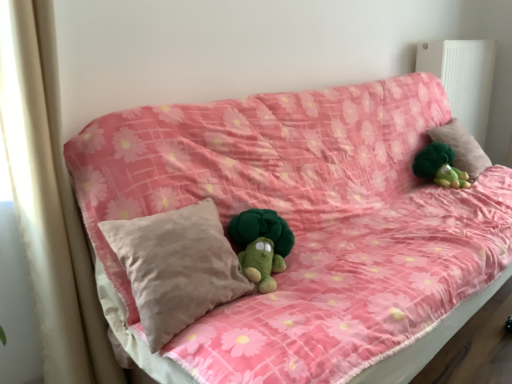
The image size is (512, 384). What do you see at coordinates (462, 147) in the screenshot?
I see `beige cotton pillow at upper right, positioned as the 2th pillow in left-to-right order` at bounding box center [462, 147].

In order to face white plastic radiator at upper right, should I rotate leftwards or rightwards?

To align with it, rotate right about 25.133°.

Image resolution: width=512 pixels, height=384 pixels. What are the coordinates of `white plastic radiator at upper right` in the screenshot? It's located at (463, 77).

You are a GUI agent. You are given a task and a screenshot of the screen. Output one action in this format:
    pyautogui.click(x=<x>, y=<y>)
    Task: Click on the beige fabric curtain at left
    The height and width of the screenshot is (384, 512).
    Given the screenshot: What is the action you would take?
    [x=39, y=194]

What do you see at coordinates (304, 220) in the screenshot? This screenshot has height=384, width=512. I see `pink fabric couch at center` at bounding box center [304, 220].

Where is `beige cotton pillow at upper right, the 1th pillow positioned from the back`? The image size is (512, 384). beige cotton pillow at upper right, the 1th pillow positioned from the back is located at coordinates [462, 147].

Is beige fabric curtain at left oriented towards pink fabric couch at center?

No, beige fabric curtain at left does not turn towards pink fabric couch at center.

Considering the sizes of objects beige fabric curtain at left and pink fabric couch at center in the image provided, who is bigger, beige fabric curtain at left or pink fabric couch at center?

pink fabric couch at center.

From the image's perspective, does beige fabric curtain at left appear higher than pink fabric couch at center?

No, from the image's perspective, beige fabric curtain at left is not on top of pink fabric couch at center.

How different are the orientations of beige soft pillow at center, placed as the second pillow when sorted from back to front, and white plastic radiator at upper right in degrees?

The angle between the facing direction of beige soft pillow at center, placed as the second pillow when sorted from back to front, and the facing direction of white plastic radiator at upper right is 0.487 degrees.

Considering the sizes of beige soft pillow at center, which ranks as the 1th pillow in bottom-to-top order, and white plastic radiator at upper right in the image, is beige soft pillow at center, which ranks as the 1th pillow in bottom-to-top order, taller or shorter than white plastic radiator at upper right?

Clearly, beige soft pillow at center, which ranks as the 1th pillow in bottom-to-top order, is shorter compared to white plastic radiator at upper right.

Is white plastic radiator at upper right at the back of beige soft pillow at center, placed as the second pillow when sorted from back to front?

No, beige soft pillow at center, placed as the second pillow when sorted from back to front,'s orientation is not away from white plastic radiator at upper right.

Is beige soft pillow at center, arranged as the second pillow when viewed from the top, not within white plastic radiator at upper right?

That's correct, beige soft pillow at center, arranged as the second pillow when viewed from the top, is outside of white plastic radiator at upper right.

Which object is wider, pink fabric couch at center or beige cotton pillow at upper right, which ranks as the 2th pillow in bottom-to-top order?

With larger width is pink fabric couch at center.

From the image's perspective, who appears lower, pink fabric couch at center or beige cotton pillow at upper right, which ranks as the 2th pillow in bottom-to-top order?

pink fabric couch at center, from the image's perspective.

Does pink fabric couch at center have a larger size compared to beige cotton pillow at upper right, positioned as the 2th pillow in left-to-right order?

Yes.

Looking at the image, does beige cotton pillow at upper right, the second pillow in the front-to-back sequence, seem bigger or smaller compared to white plastic radiator at upper right?

beige cotton pillow at upper right, the second pillow in the front-to-back sequence, is smaller than white plastic radiator at upper right.

Can you tell me how much beige cotton pillow at upper right, which is the 1th pillow from top to bottom, and white plastic radiator at upper right differ in facing direction?

4.84 degrees separate the facing orientations of beige cotton pillow at upper right, which is the 1th pillow from top to bottom, and white plastic radiator at upper right.

The width and height of the screenshot is (512, 384). In order to click on radiator above the beige cotton pillow at upper right, which is the 1th pillow from top to bottom (from a real-world perspective) in this screenshot , I will do `click(463, 77)`.

Between beige cotton pillow at upper right, which is the 1th pillow from top to bottom, and white plastic radiator at upper right, which one has smaller width?

white plastic radiator at upper right.

Is beige soft pillow at center, placed as the second pillow when sorted from back to front, taller than beige cotton pillow at upper right, placed as the first pillow when sorted from right to left?

Yes, beige soft pillow at center, placed as the second pillow when sorted from back to front, is taller than beige cotton pillow at upper right, placed as the first pillow when sorted from right to left.

Looking at the image, does beige soft pillow at center, which ranks as the 1th pillow in bottom-to-top order, seem bigger or smaller compared to beige cotton pillow at upper right, the 1th pillow positioned from the back?

Considering their sizes, beige soft pillow at center, which ranks as the 1th pillow in bottom-to-top order, takes up more space than beige cotton pillow at upper right, the 1th pillow positioned from the back.

Does point (183, 283) come in front of point (468, 144)?

Yes.

Is beige soft pillow at center, which is counted as the second pillow, starting from the right, completely or partially outside of beige cotton pillow at upper right, the 1th pillow positioned from the back?

Yes, beige soft pillow at center, which is counted as the second pillow, starting from the right, is located beyond the bounds of beige cotton pillow at upper right, the 1th pillow positioned from the back.

Locate an element on the screen. This screenshot has width=512, height=384. pillow on the left of beige cotton pillow at upper right, placed as the first pillow when sorted from right to left is located at coordinates (176, 267).

From the picture: Is beige cotton pillow at upper right, which ranks as the 2th pillow in bottom-to-top order, inside the boundaries of beige soft pillow at center, which is counted as the first pillow, starting from the left, or outside?

beige cotton pillow at upper right, which ranks as the 2th pillow in bottom-to-top order, is spatially situated outside beige soft pillow at center, which is counted as the first pillow, starting from the left.

Is beige cotton pillow at upper right, placed as the first pillow when sorted from right to left, shorter than beige soft pillow at center, which is counted as the second pillow, starting from the right?

Indeed, beige cotton pillow at upper right, placed as the first pillow when sorted from right to left, has a lesser height compared to beige soft pillow at center, which is counted as the second pillow, starting from the right.

From a real-world perspective, which is physically above, beige cotton pillow at upper right, which ranks as the 2th pillow in bottom-to-top order, or beige soft pillow at center, which is counted as the second pillow, starting from the right?

beige cotton pillow at upper right, which ranks as the 2th pillow in bottom-to-top order, from a real-world perspective.

Which is correct: pink fabric couch at center is inside white plastic radiator at upper right, or outside of it?

pink fabric couch at center is outside white plastic radiator at upper right.

Considering the relative sizes of pink fabric couch at center and white plastic radiator at upper right in the image provided, is pink fabric couch at center taller than white plastic radiator at upper right?

Correct, pink fabric couch at center is much taller as white plastic radiator at upper right.

Considering the points (337, 202) and (470, 117), which point is in front, point (337, 202) or point (470, 117)?

The point (337, 202) is in front.

Is white plastic radiator at upper right at the back of pink fabric couch at center?

No.

Locate an element on the screen. This screenshot has width=512, height=384. furniture located on the right of beige fabric curtain at left is located at coordinates (304, 220).

This screenshot has width=512, height=384. In order to click on pillow that is the 2nd one when counting downward from the white plastic radiator at upper right (from the image's perspective) in this screenshot , I will do 176,267.

Estimate the real-world distances between objects in this image. Which object is closer to green plush toy at upper right, white plastic radiator at upper right or beige soft pillow at center, which is counted as the second pillow, starting from the right?

white plastic radiator at upper right.

Based on their spatial positions, is green plush toy at upper right or beige cotton pillow at upper right, which ranks as the 2th pillow in bottom-to-top order, further from white plastic radiator at upper right?

Among the two, green plush toy at upper right is located further to white plastic radiator at upper right.

In the scene shown: Considering their positions, is beige cotton pillow at upper right, the 1th pillow positioned from the back, positioned further to beige soft pillow at center, placed as the second pillow when sorted from back to front, than white plastic radiator at upper right?

white plastic radiator at upper right lies further to beige soft pillow at center, placed as the second pillow when sorted from back to front, than the other object.

From the image, which object appears to be farther from beige soft pillow at center, which is counted as the first pillow, starting from the left, white plastic radiator at upper right or green plush toy at upper right?

white plastic radiator at upper right is further to beige soft pillow at center, which is counted as the first pillow, starting from the left.

Estimate the real-world distances between objects in this image. Which object is further from beige fabric curtain at left, beige cotton pillow at upper right, the second pillow in the front-to-back sequence, or beige soft pillow at center, placed as the second pillow when sorted from back to front?

Based on the image, beige cotton pillow at upper right, the second pillow in the front-to-back sequence, appears to be further to beige fabric curtain at left.

Considering their positions, is pink fabric couch at center positioned closer to green plush toy at upper right than beige cotton pillow at upper right, placed as the first pillow when sorted from right to left?

beige cotton pillow at upper right, placed as the first pillow when sorted from right to left, lies closer to green plush toy at upper right than the other object.

Based on their spatial positions, is beige fabric curtain at left or beige soft pillow at center, which is counted as the first pillow, starting from the front, further from pink fabric couch at center?

beige fabric curtain at left lies further to pink fabric couch at center than the other object.

When comparing their distances from white plastic radiator at upper right, does pink fabric couch at center or beige fabric curtain at left seem further?

The object further to white plastic radiator at upper right is beige fabric curtain at left.

Locate an element on the screen. This screenshot has width=512, height=384. pillow between beige fabric curtain at left and green plush toy at upper right from left to right is located at coordinates (176, 267).

Locate an element on the screen. toy between pink fabric couch at center and beige cotton pillow at upper right, which ranks as the 2th pillow in bottom-to-top order, along the z-axis is located at coordinates (440, 166).

Locate an element on the screen. Image resolution: width=512 pixels, height=384 pixels. furniture between beige fabric curtain at left and beige cotton pillow at upper right, which ranks as the 2th pillow in bottom-to-top order, in the horizontal direction is located at coordinates (304, 220).

The width and height of the screenshot is (512, 384). What are the coordinates of `toy situated between beige soft pillow at center, which is counted as the second pillow, starting from the right, and white plastic radiator at upper right from left to right` in the screenshot? It's located at (440, 166).